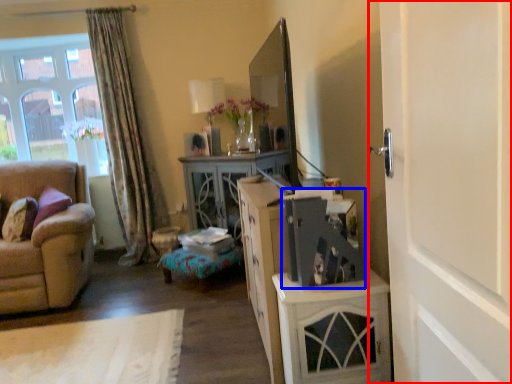
Question: Which point is further to the camera, door (highlighted by a red box) or appliance (highlighted by a blue box)?

Choices:
 (A) door
 (B) appliance

Answer: (B)